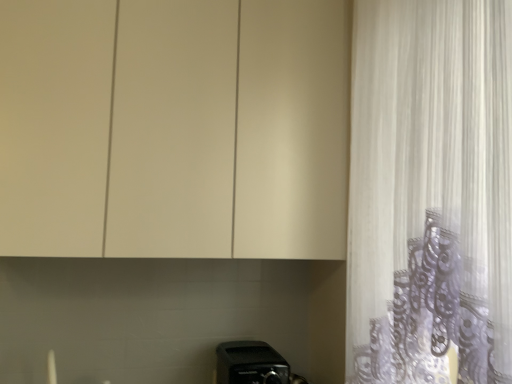
Question: From a real-world perspective, is matte white cabinet at upper center above or below white sheer curtain at right?

Choices:
 (A) above
 (B) below

Answer: (A)

Question: In the image, is matte white cabinet at upper center on the left side or the right side of white sheer curtain at right?

Choices:
 (A) right
 (B) left

Answer: (B)

Question: Which object is positioned closest to the matte white cabinet at upper center?

Choices:
 (A) white sheer curtain at right
 (B) black plastic toaster at lower center

Answer: (A)

Question: Which object is the closest to the white sheer curtain at right?

Choices:
 (A) black plastic toaster at lower center
 (B) matte white cabinet at upper center

Answer: (B)